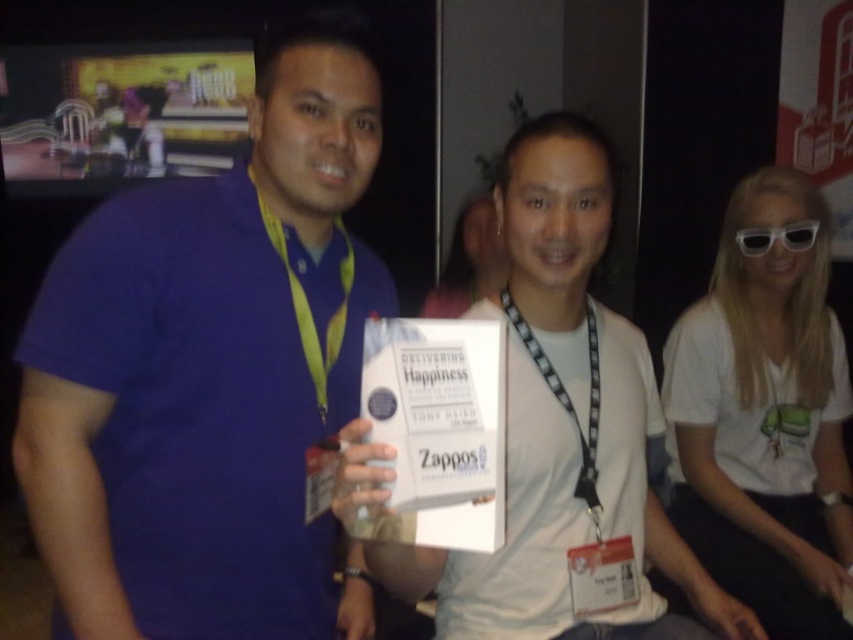
Question: Does matte blue shirt at left have a lesser width compared to white plastic goggles at upper right?

Choices:
 (A) yes
 (B) no

Answer: (B)

Question: Observing the image, what is the correct spatial positioning of matte blue shirt at left in reference to white matte book at center?

Choices:
 (A) left
 (B) right

Answer: (A)

Question: Is white matte t-shirt at center bigger than white plastic goggles at upper right?

Choices:
 (A) no
 (B) yes

Answer: (B)

Question: Which point is closer to the camera?

Choices:
 (A) white matte t-shirt at center
 (B) matte blue shirt at left
 (C) white matte book at center
 (D) white plastic goggles at upper right

Answer: (C)

Question: Estimate the real-world distances between objects in this image. Which object is closer to the white matte t-shirt at center?

Choices:
 (A) matte blue shirt at left
 (B) white plastic goggles at upper right

Answer: (B)

Question: Which of the following is the closest to the observer?

Choices:
 (A) (354, 452)
 (B) (758, 244)

Answer: (A)